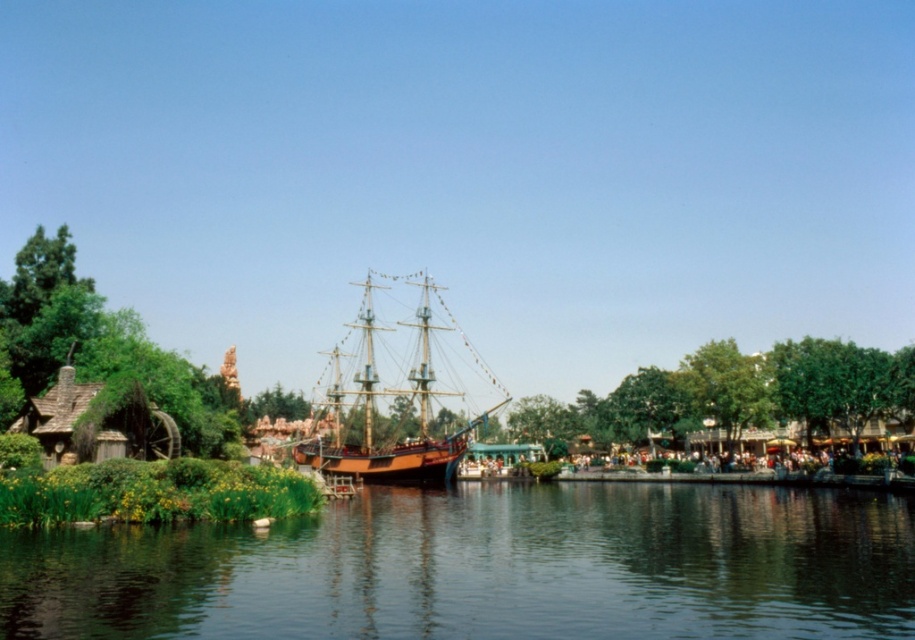
Does point (732, 524) come in front of point (413, 392)?

Yes, point (732, 524) is closer to viewer.

Where is `smooth dark water at center`? This screenshot has height=640, width=915. smooth dark water at center is located at coordinates (487, 566).